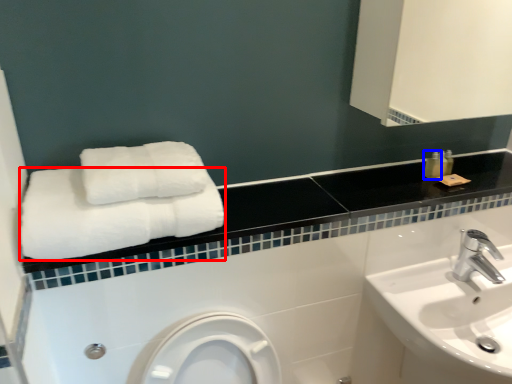
Question: Which object appears farthest to the camera in this image, towel (highlighted by a red box) or toiletry (highlighted by a blue box)?

Choices:
 (A) towel
 (B) toiletry

Answer: (B)